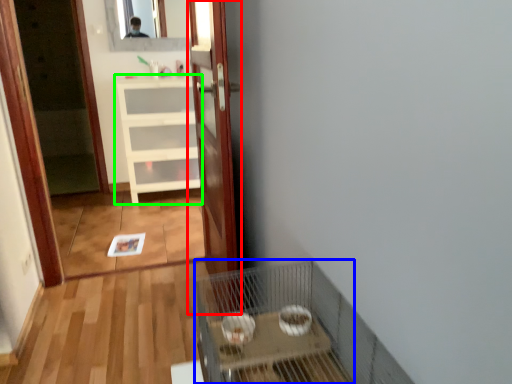
Question: Which is farther away from door (highlighted by a red box)? cage (highlighted by a blue box) or cabinetry (highlighted by a green box)?

Choices:
 (A) cage
 (B) cabinetry

Answer: (B)